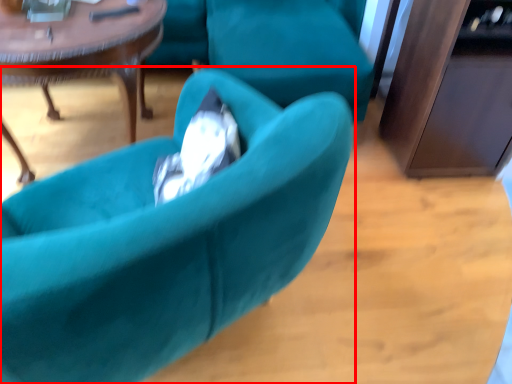
Question: From the image's perspective, where is chair (annotated by the red box) located in relation to coffee table in the image?

Choices:
 (A) below
 (B) above

Answer: (A)